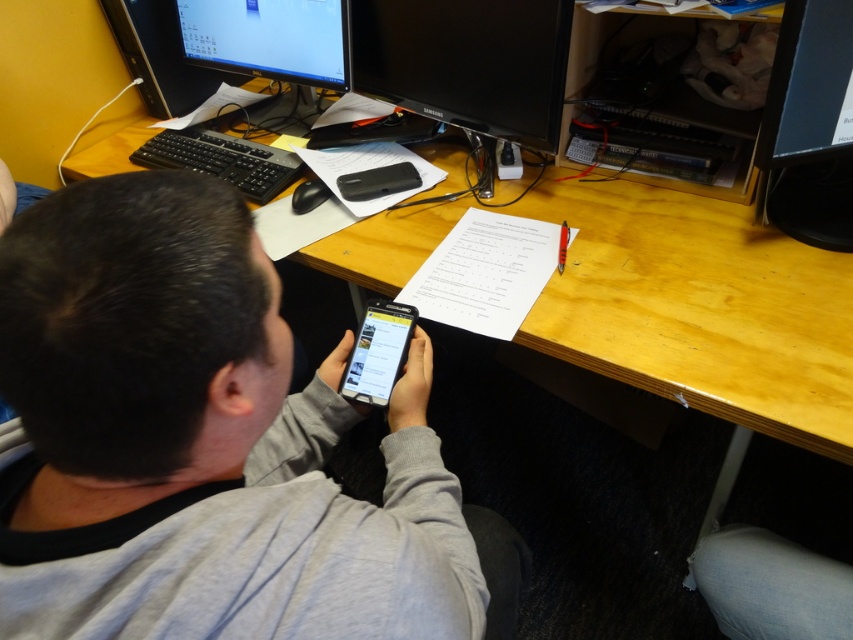
Question: Based on their relative distances, which object is farther from the black glossy monitor at center?

Choices:
 (A) black glossy monitor at upper left
 (B) black glossy monitor at upper right

Answer: (B)

Question: Which point is farther to the camera?

Choices:
 (A) matte black monitor at upper left
 (B) black glossy monitor at upper left
 (C) black glossy monitor at center

Answer: (A)

Question: Which point is farther from the camera taking this photo?

Choices:
 (A) (258, 195)
 (B) (416, 566)

Answer: (A)

Question: Does black glossy monitor at upper left come in front of matte black monitor at upper left?

Choices:
 (A) yes
 (B) no

Answer: (A)

Question: Does black glossy monitor at upper left have a larger size compared to matte black monitor at upper left?

Choices:
 (A) no
 (B) yes

Answer: (B)

Question: Is black glossy monitor at upper right behind matte black monitor at upper left?

Choices:
 (A) yes
 (B) no

Answer: (B)